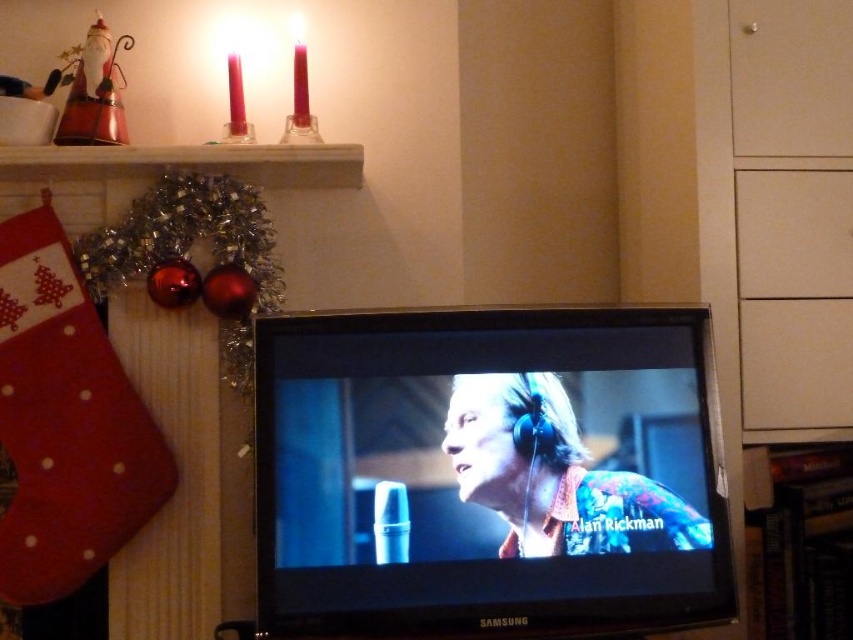
You are setting up a holiday display and want to place a decorative item between the matte black tv at center and the red felt stocking at left. Based on their sizes, which object should you place closer to the smaller one to maintain balance?

The matte black tv at center is larger in size than the red felt stocking at left, so to maintain balance, place the decorative item closer to the red felt stocking at left since it is smaller.

You are standing in front of the mantelpiece and want to place a small decoration exactly at point (65, 422). Which object is already at that location?

The red felt stocking at left is already located at point (65, 422).

Looking at this image, you are standing in front of the mantelpiece with the red Christmas stocking and the Samsung television. You want to place a small decoration exactly at the point marked by the coordinates point (55,376). If the decoration is 0.5 meters in diameter, will it fit without overlapping any existing objects?

The point (55,376) is 1.36 meters away from the camera. Since the decoration is only 0.5 meters in diameter, it will fit without overlapping any existing objects as there is sufficient space at that distance.